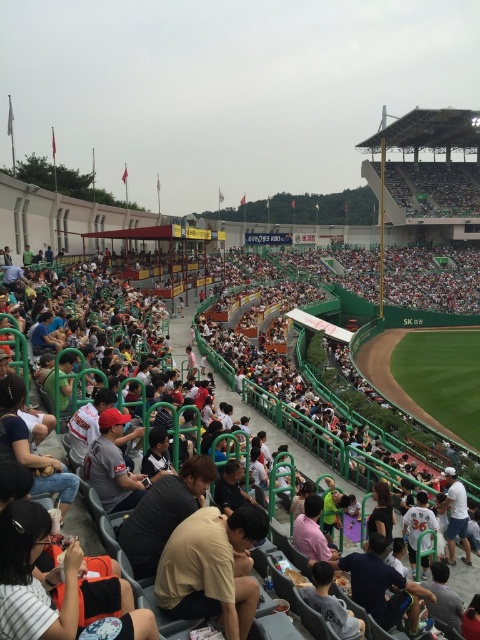
You are a photographer trying to capture a wide shot of the baseball stadium. You need to position yourself so that your camera is exactly at the location of the green plastic seats at center. What are the coordinates where you should place your camera?

The coordinates for the green plastic seats at center are at point [330,417], so you should place your camera there.

You are a photographer positioned at the center of the baseball stadium. You want to capture a photo of the crowd while ensuring that the point marked at coordinates point (330, 417) is visible in the frame. Given that the green plastic seats at center are part of the seating area, where should you position yourself to include this point in your photo?

To include the point (330, 417) on green plastic seats at center in your photo, position yourself at the center of the baseball stadium facing towards the green plastic seats at center. This will ensure the point is within the frame.

You are standing at the point marked as point (36, 301) in the baseball stadium. You want to take a photo of the entire field using a camera that has a maximum range of 50 meters. Will you be able to capture the entire field in your photo?

The distance between point (36, 301) and the camera is 52.91 meters, which exceeds the camera maximum range of 50 meters. Therefore, you will not be able to capture the entire field in your photo.